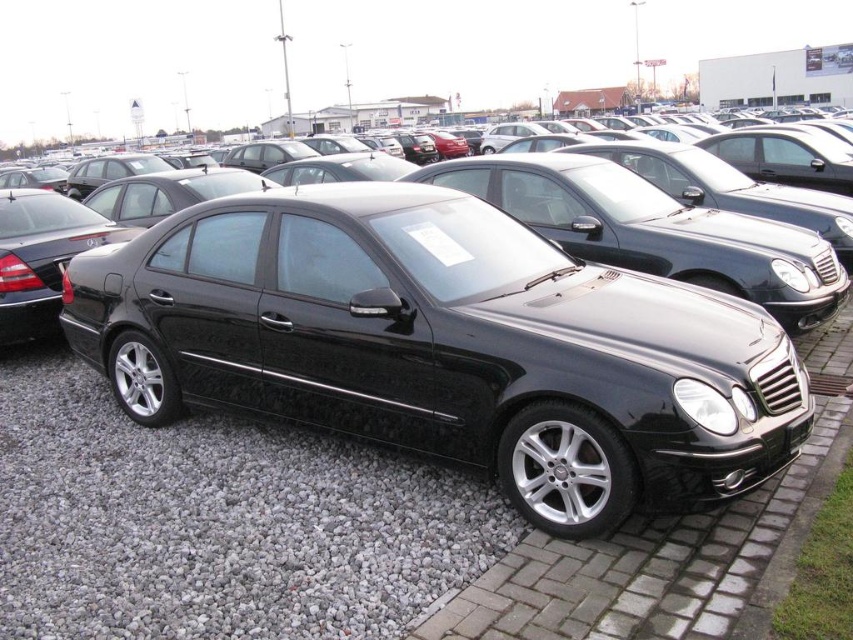
You are a delivery person trying to park a delivery van that is 2 meters wide. You see the glossy black car at center and the gray gravel at lower center. Can you park your van between them without overlapping either?

The glossy black car at center is to the right of gray gravel at lower center. Since the van is 2 meters wide, you need to check the distance between them. However, the exact distance isn not provided in the description, so it is uncertain if there is enough space. Please measure the gap before attempting to park.

What are the coordinates of the glossy black car at center?

The glossy black car at center is located at coordinates point (445,346).

Consider the image. You are a delivery person trying to park a new car that is exactly the same width as the glossy black car at center. The parking spot is marked by the gray gravel at lower center. Can your car fit into the parking spot without overlapping the gravel area?

The glossy black car at center is wider than the gray gravel at lower center, so your car may not fit into the parking spot without overlapping the gravel area.